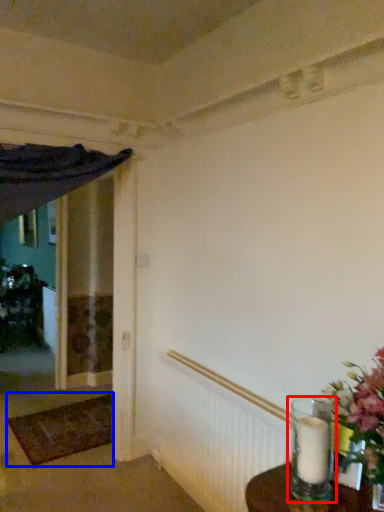
Question: Which point is closer to the camera, candle holder (highlighted by a red box) or doormat (highlighted by a blue box)?

Choices:
 (A) candle holder
 (B) doormat

Answer: (A)